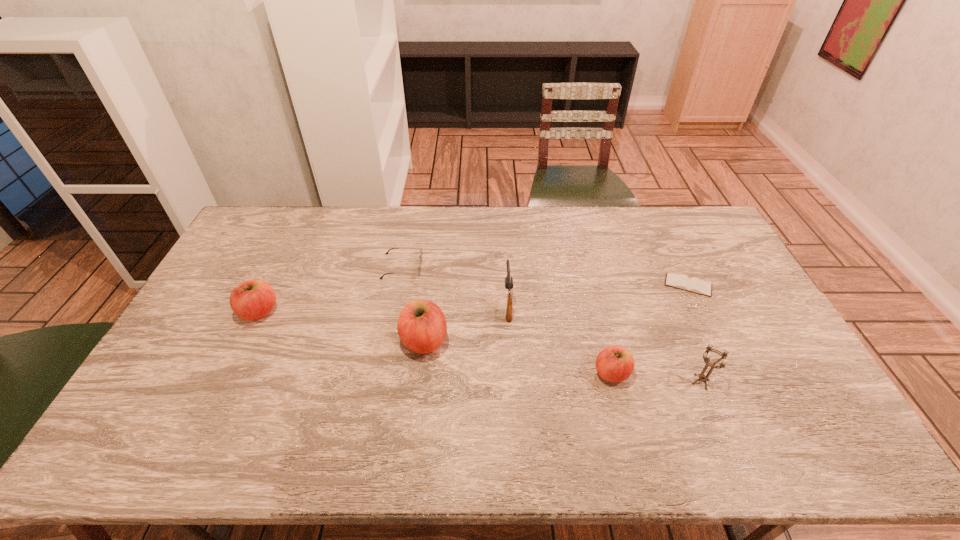
What are the coordinates of `object located in the left edge section of the desktop` in the screenshot? It's located at (254, 299).

You are a GUI agent. You are given a task and a screenshot of the screen. Output one action in this format:
    pyautogui.click(x=<x>, y=<y>)
    Task: Click on the object that is at the right edge
    
    Given the screenshot: What is the action you would take?
    pyautogui.click(x=680, y=281)

Image resolution: width=960 pixels, height=540 pixels. In order to click on vacant area at the far edge of the desktop in this screenshot , I will do `click(379, 230)`.

In the image, there is a desktop. Where is `vacant space at the near edge`? This screenshot has height=540, width=960. vacant space at the near edge is located at coordinates (228, 392).

I want to click on free region at the left edge of the desktop, so click(x=199, y=306).

Image resolution: width=960 pixels, height=540 pixels. What are the coordinates of `free spot at the near left corner of the desktop` in the screenshot? It's located at (177, 407).

Locate an element on the screen. Image resolution: width=960 pixels, height=540 pixels. vacant space at the near right corner of the desktop is located at coordinates (807, 410).

Locate an element on the screen. The image size is (960, 540). vacant region between the candle holder and the tallest apple is located at coordinates (563, 361).

Find the location of a particular element. free space between the shortest object and the fifth object from left to right is located at coordinates (650, 329).

You are a GUI agent. You are given a task and a screenshot of the screen. Output one action in this format:
    pyautogui.click(x=<x>, y=<y>)
    Task: Click on the vacant point located between the sunglasses and the leftmost apple
    This screenshot has width=960, height=540.
    Given the screenshot: What is the action you would take?
    pyautogui.click(x=331, y=289)